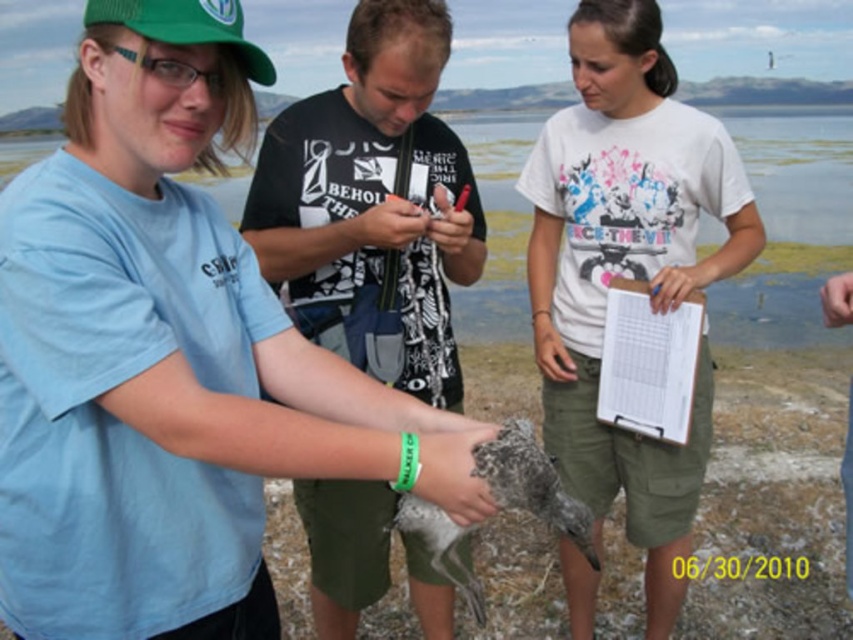
Is clear water at center wider than green fabric baseball cap at upper left?

Correct, the width of clear water at center exceeds that of green fabric baseball cap at upper left.

Is clear water at center above green fabric baseball cap at upper left?

Yes, clear water at center is above green fabric baseball cap at upper left.

Where is `clear water at center`? clear water at center is located at coordinates (788, 227).

I want to click on clear water at center, so click(x=788, y=227).

Is point (442, 145) positioned in front of point (686, 403)?

That is True.

Is matte black shirt at center smaller than white paper clipboard at center?

Actually, matte black shirt at center might be larger than white paper clipboard at center.

Locate an element on the screen. This screenshot has height=640, width=853. matte black shirt at center is located at coordinates (375, 188).

Between clear water at center and white paper clipboard at center, which one appears on the left side from the viewer's perspective?

Positioned to the left is white paper clipboard at center.

Is point (492, 182) behind point (631, 301)?

Yes.

At what (x,y) coordinates should I click in order to perform the action: click on clear water at center. Please return your answer as a coordinate pair (x, y). Looking at the image, I should click on (788, 227).